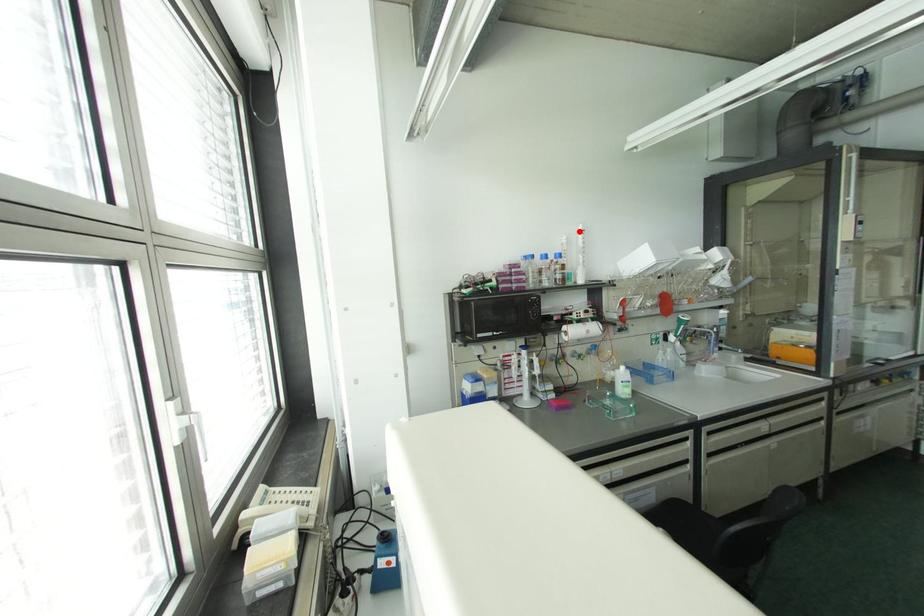
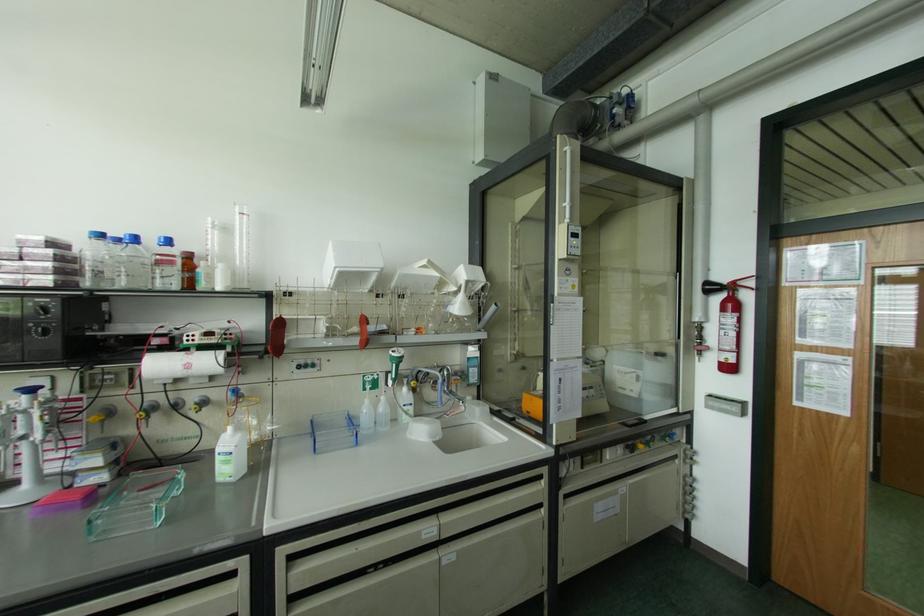
Where in the second image is the point corresponding to the highlighted location from the first image?

(237, 216)